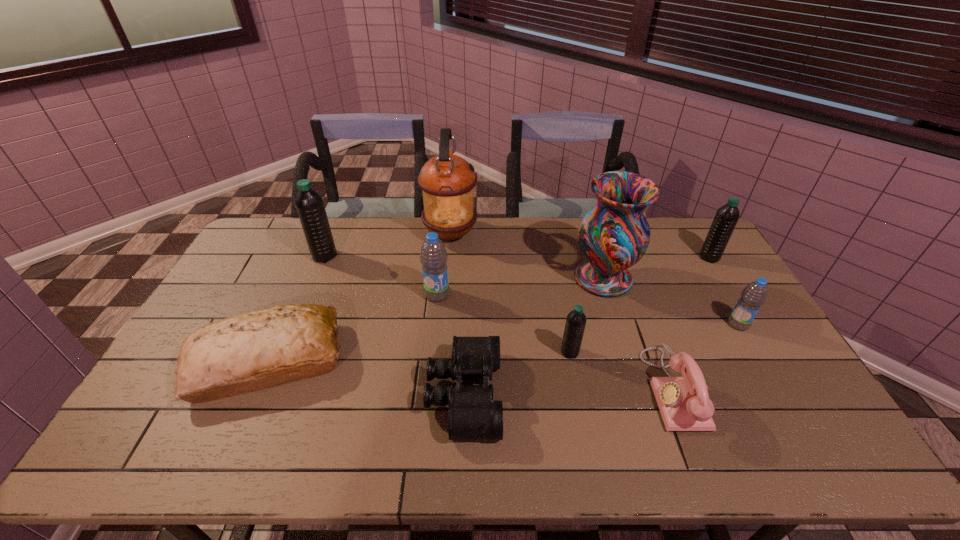
In order to click on free point that satisfies the following two spatial constraints: 1. on the back side of the bread; 2. on the left side of the nearer blue water bottle in this screenshot , I will do `click(284, 324)`.